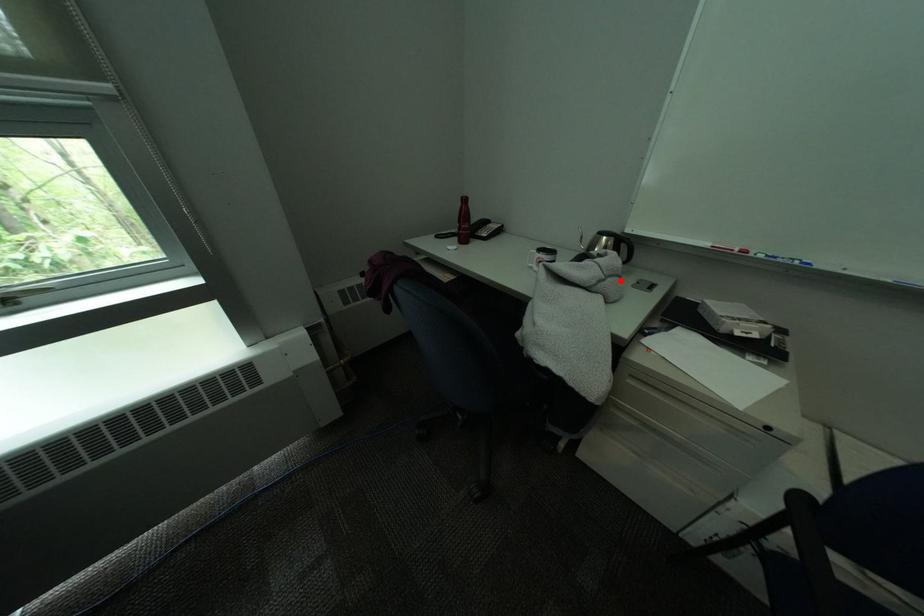
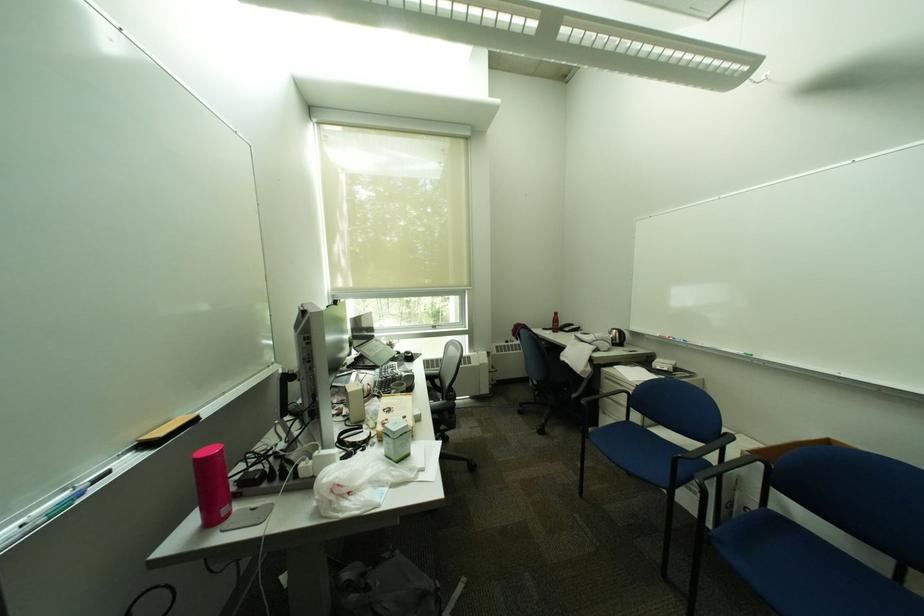
The point at the highlighted location is marked in the first image. Where is the corresponding point in the second image?

(611, 342)